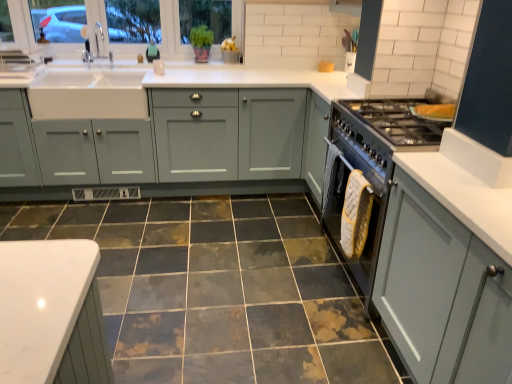
Question: Is marbled ceramic tile at center closer to camera compared to matte gray cabinet at right, which appears as the 2th cabinetry when viewed from the back?

Choices:
 (A) yes
 (B) no

Answer: (B)

Question: Would you say marbled ceramic tile at center is a long distance from matte gray cabinet at right, which appears as the first cabinetry when viewed from the right?

Choices:
 (A) no
 (B) yes

Answer: (A)

Question: Is marbled ceramic tile at center taller than matte gray cabinet at right, the 2th cabinetry positioned from the left?

Choices:
 (A) yes
 (B) no

Answer: (B)

Question: From a real-world perspective, is marbled ceramic tile at center under matte gray cabinet at right, the 2th cabinetry positioned from the left?

Choices:
 (A) no
 (B) yes

Answer: (B)

Question: Considering the relative sizes of marbled ceramic tile at center and matte gray cabinet at right, the first cabinetry ordered from the bottom, in the image provided, is marbled ceramic tile at center shorter than matte gray cabinet at right, the first cabinetry ordered from the bottom,?

Choices:
 (A) no
 (B) yes

Answer: (B)

Question: Based on their sizes in the image, would you say marbled ceramic tile at center is bigger or smaller than matte gray cabinets at center, which ranks as the second cabinetry in right-to-left order?

Choices:
 (A) small
 (B) big

Answer: (A)

Question: Is marbled ceramic tile at center inside the boundaries of matte gray cabinets at center, the 2th cabinetry when ordered from bottom to top, or outside?

Choices:
 (A) inside
 (B) outside

Answer: (B)

Question: Is marbled ceramic tile at center wider or thinner than matte gray cabinets at center, which ranks as the second cabinetry in right-to-left order?

Choices:
 (A) wide
 (B) thin

Answer: (A)

Question: Relative to matte gray cabinets at center, arranged as the 2th cabinetry when viewed from the front, is marbled ceramic tile at center in front or behind?

Choices:
 (A) behind
 (B) front

Answer: (B)

Question: Which is correct: teal matte soap dispenser at upper center is inside stainless steel oven at right, or outside of it?

Choices:
 (A) outside
 (B) inside

Answer: (A)

Question: Considering the positions of teal matte soap dispenser at upper center and stainless steel oven at right in the image, is teal matte soap dispenser at upper center taller or shorter than stainless steel oven at right?

Choices:
 (A) tall
 (B) short

Answer: (B)

Question: Looking at their shapes, would you say teal matte soap dispenser at upper center is wider or thinner than stainless steel oven at right?

Choices:
 (A) thin
 (B) wide

Answer: (A)

Question: Considering the positions of point (147, 51) and point (367, 294), is point (147, 51) closer or farther from the camera than point (367, 294)?

Choices:
 (A) closer
 (B) farther

Answer: (B)

Question: Is clear glass window at upper left taller or shorter than stainless steel oven at right?

Choices:
 (A) tall
 (B) short

Answer: (B)

Question: From a real-world perspective, is clear glass window at upper left positioned above or below stainless steel oven at right?

Choices:
 (A) below
 (B) above

Answer: (B)